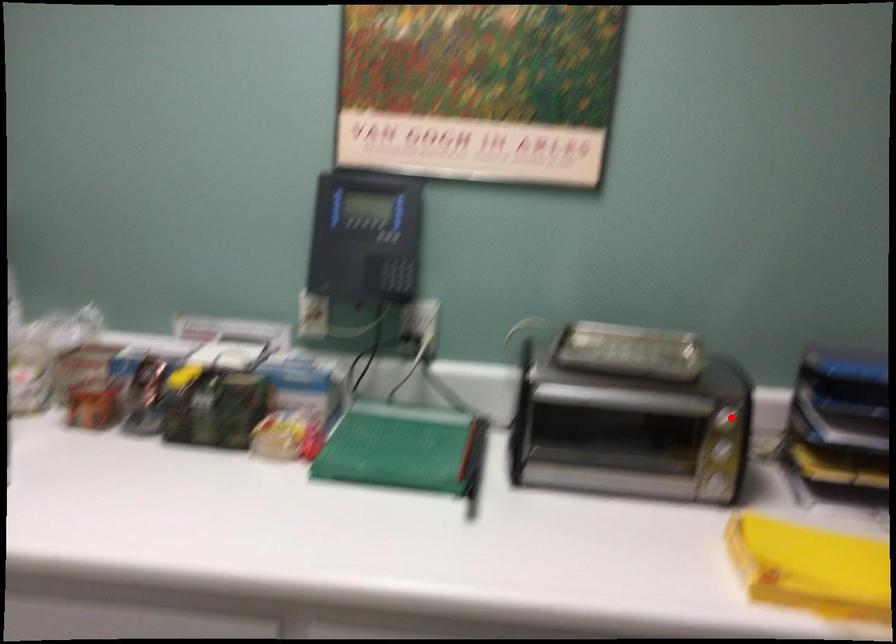
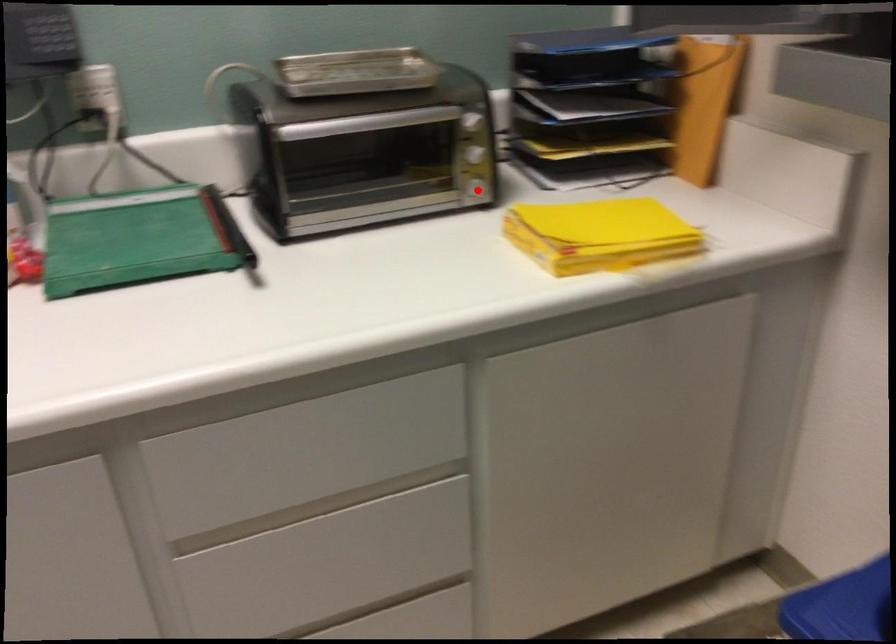
I am providing you with two images of the same scene from different viewpoints. A red point is marked on the first image and another point is marked on the second image. Are the points marked in image1 and image2 representing the same 3D position?

No